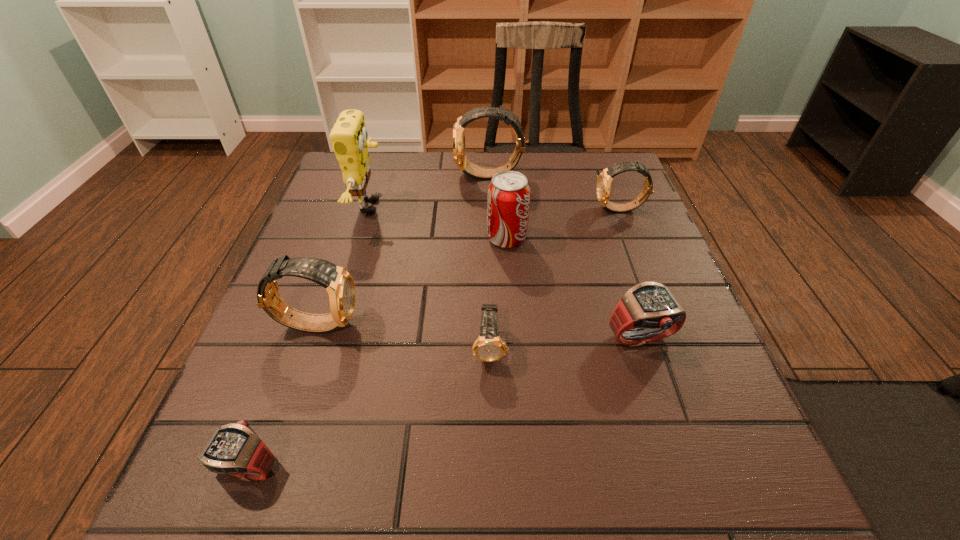
You are a GUI agent. You are given a task and a screenshot of the screen. Output one action in this format:
    pyautogui.click(x=<x>, y=<y>)
    Task: Click on the object present at the near left corner
    
    Given the screenshot: What is the action you would take?
    pyautogui.click(x=235, y=449)

At what (x,y) coordinates should I click in order to perform the action: click on vacant space at the far edge of the desktop. Please return your answer as a coordinate pair (x, y). The height and width of the screenshot is (540, 960). Looking at the image, I should click on (445, 182).

This screenshot has height=540, width=960. In the image, there is a desktop. What are the coordinates of `vacant space at the near edge` in the screenshot? It's located at (x=465, y=460).

Locate an element on the screen. vacant space at the left edge is located at coordinates (319, 390).

I want to click on free space at the right edge of the desktop, so click(x=706, y=400).

This screenshot has height=540, width=960. I want to click on free spot at the far left corner of the desktop, so click(373, 163).

This screenshot has width=960, height=540. Identify the location of free spot at the near left corner of the desktop. (228, 529).

Find the location of a particular element. The height and width of the screenshot is (540, 960). vacant area that lies between the farthest gold watch and the second farthest watch is located at coordinates (555, 192).

I want to click on free space between the smallest gold watch and the soda, so click(498, 293).

The width and height of the screenshot is (960, 540). I want to click on vacant space that is in between the smallest gold watch and the farthest gold watch, so click(490, 261).